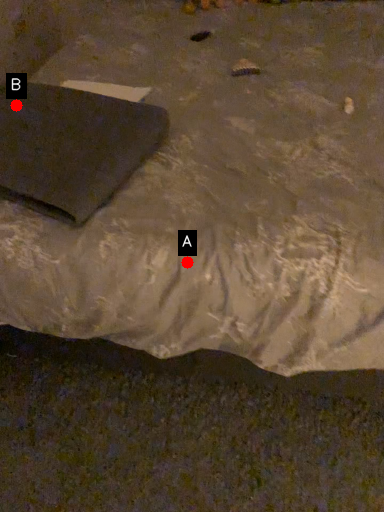
Question: Two points are circled on the image, labeled by A and B beside each circle. Which point is further to the camera?

Choices:
 (A) A is further
 (B) B is further

Answer: (B)